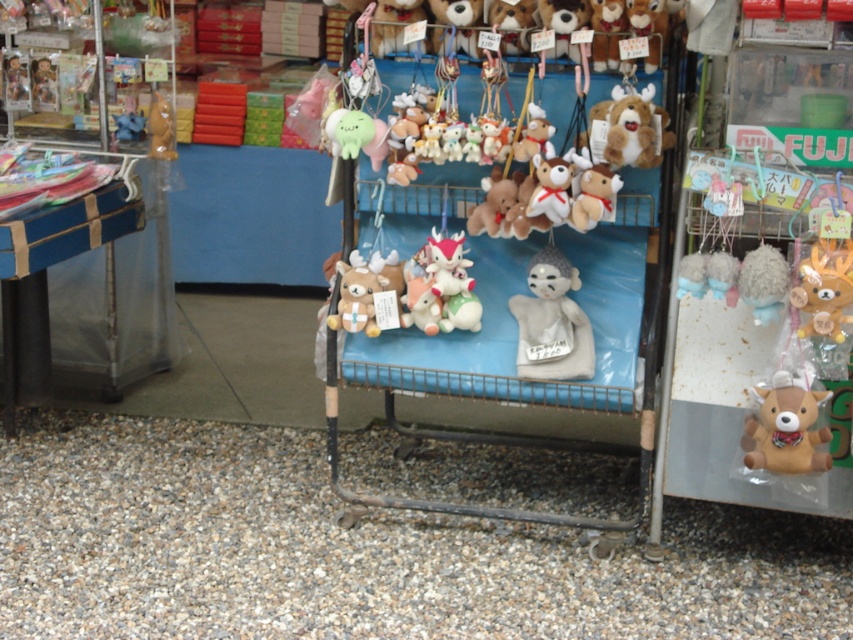
You are a customer at the market and want to reach the velvet plush toys at center from your current position. The cart is 10 feet wide. Can you safely walk around the cart to reach them without stepping into the aisle?

The velvet plush toys at center are 10.53 feet apart, which is slightly wider than the cart itself. Since the cart is only 10 feet wide, there might be a small gap on either side. However, attempting to walk around could be risky as the distance is very close. It would be safer to go around the front or back of the cart instead.

Looking at this image, you are a customer at the market looking to buy a plush toy. You want to choose the wider item between the velvet plush toys at center and the brown plush deer at lower right. Which one should you pick?

The velvet plush toys at center are wider than the brown plush deer at lower right, so you should pick the velvet plush toys at center.

You are a customer at the market and want to place a small gift on the cart. The gift requires both the brown plush deer at lower right and the matte brown bear at upper left to be within 3 meters of each other. Can you confirm if they are close enough?

The brown plush deer at lower right and matte brown bear at upper left are 2.84 meters apart from each other, so they are within the 3 meters requirement. The gift can be placed on the cart.